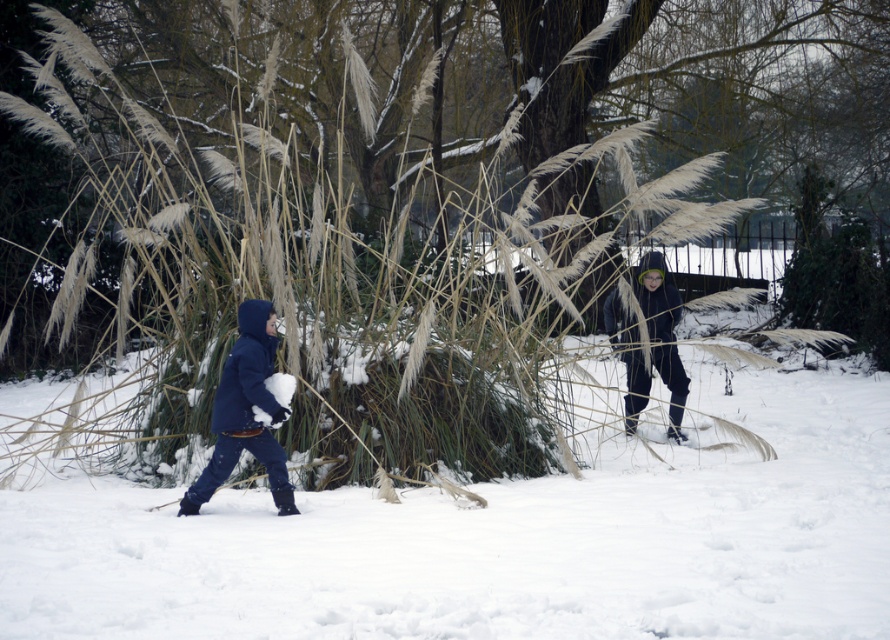
Does white fluffy snow at center have a smaller size compared to matte blue coat at left?

No, white fluffy snow at center is not smaller than matte blue coat at left.

Is point (851, 432) in front of point (267, 323)?

No, (851, 432) is behind (267, 323).

Between point (28, 588) and point (239, 353), which one is positioned behind?

The point (239, 353) is more distant.

In order to click on white fluffy snow at center in this screenshot , I will do `click(498, 540)`.

In the scene shown: Is matte blue coat at left to the left of dark blue hooded jacket at center from the viewer's perspective?

Indeed, matte blue coat at left is positioned on the left side of dark blue hooded jacket at center.

Can you confirm if matte blue coat at left is smaller than dark blue hooded jacket at center?

Indeed, matte blue coat at left has a smaller size compared to dark blue hooded jacket at center.

Identify the location of matte blue coat at left. (245, 412).

At what (x,y) coordinates should I click in order to perform the action: click on matte blue coat at left. Please return your answer as a coordinate pair (x, y). The height and width of the screenshot is (640, 890). Looking at the image, I should click on (245, 412).

Between white fluffy snow at center and dark blue hooded jacket at center, which one has less height?

With less height is white fluffy snow at center.

Identify the location of white fluffy snow at center. (498, 540).